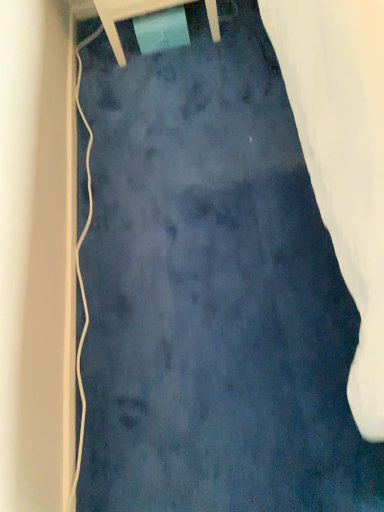
Find the location of `matte plastic chair at upper center`. matte plastic chair at upper center is located at coordinates (127, 17).

The width and height of the screenshot is (384, 512). What do you see at coordinates (127, 17) in the screenshot?
I see `matte plastic chair at upper center` at bounding box center [127, 17].

This screenshot has height=512, width=384. Find the location of `matte plastic chair at upper center`. matte plastic chair at upper center is located at coordinates [127, 17].